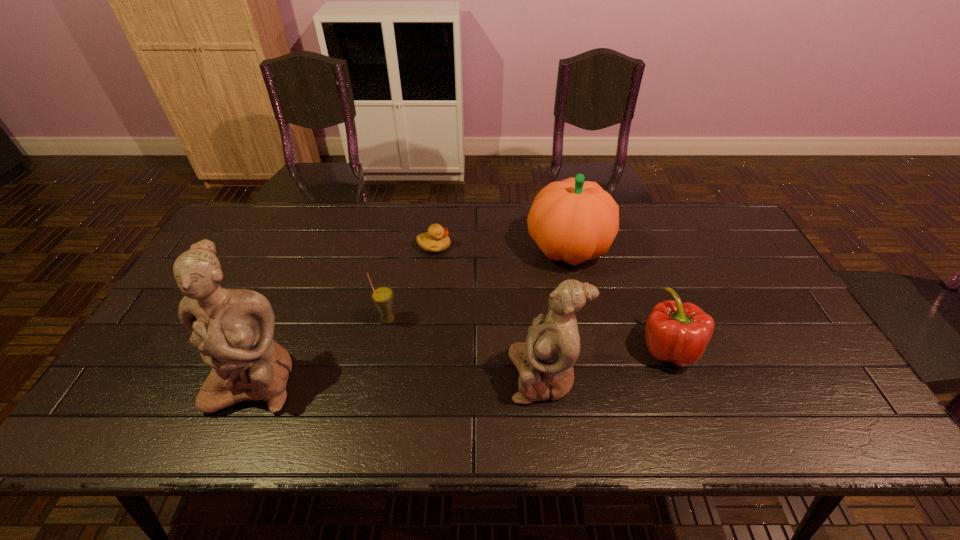
All figurines are currently evenly spaced. To continue this pattern, where would you add another figurine on the right? Please point out a vacant spot. Please provide its 2D coordinates. Your answer should be formatted as a tuple, i.e. [(x, y)], where the tuple contains the x and y coordinates of a point satisfying the conditions above.

[(828, 373)]